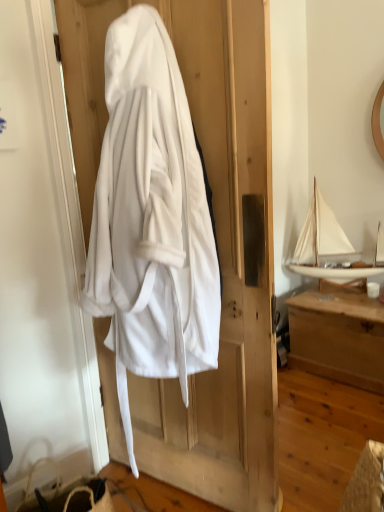
Locate an element on the screen. Image resolution: width=384 pixels, height=512 pixels. free area below white wooden boat at upper right (from a real-world perspective) is located at coordinates (344, 294).